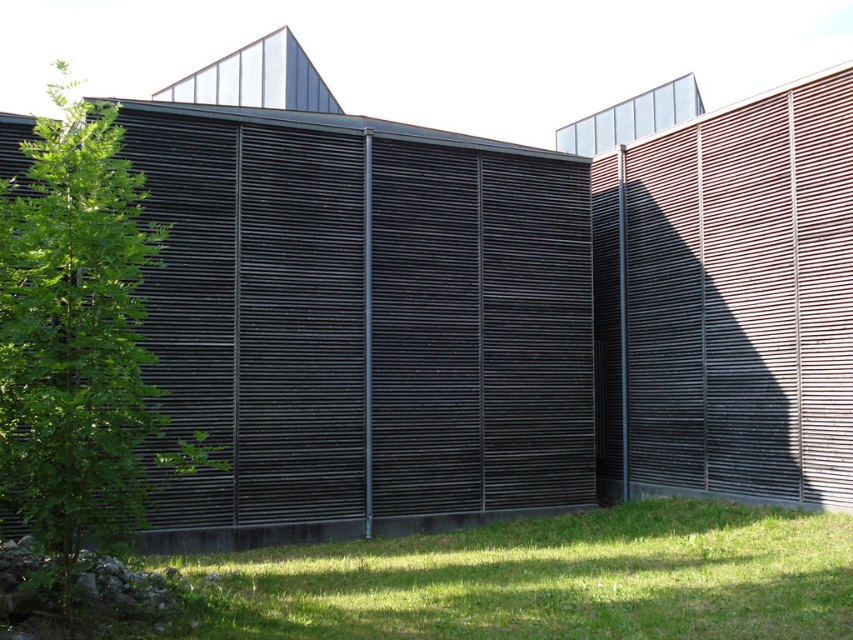
Question: Can you confirm if green grass at lower center is positioned to the right of green leafy tree at left?

Choices:
 (A) yes
 (B) no

Answer: (A)

Question: Is green grass at lower center positioned at the back of green leafy tree at left?

Choices:
 (A) yes
 (B) no

Answer: (A)

Question: Is green grass at lower center positioned before green leafy tree at left?

Choices:
 (A) yes
 (B) no

Answer: (B)

Question: Which point is farther to the camera?

Choices:
 (A) (131, 340)
 (B) (785, 547)

Answer: (B)